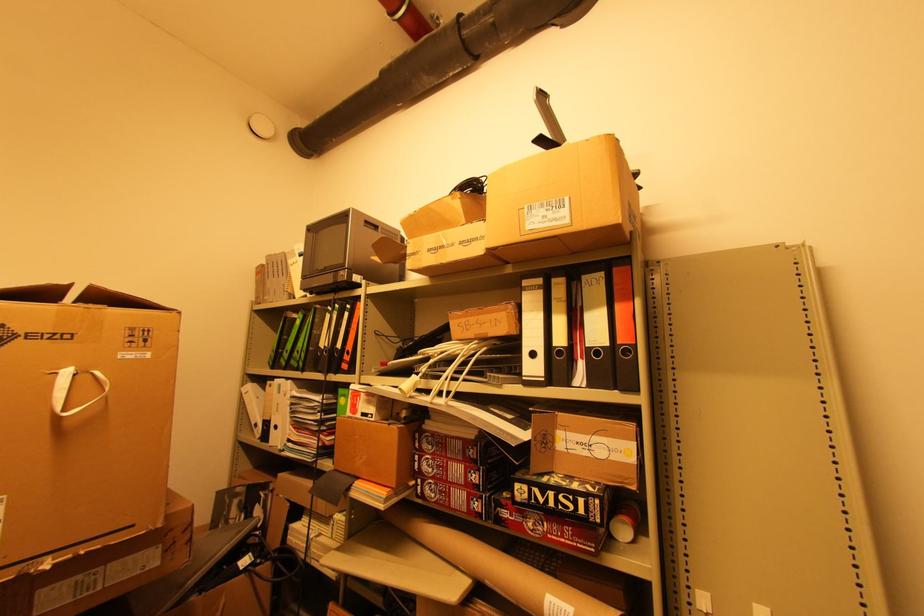
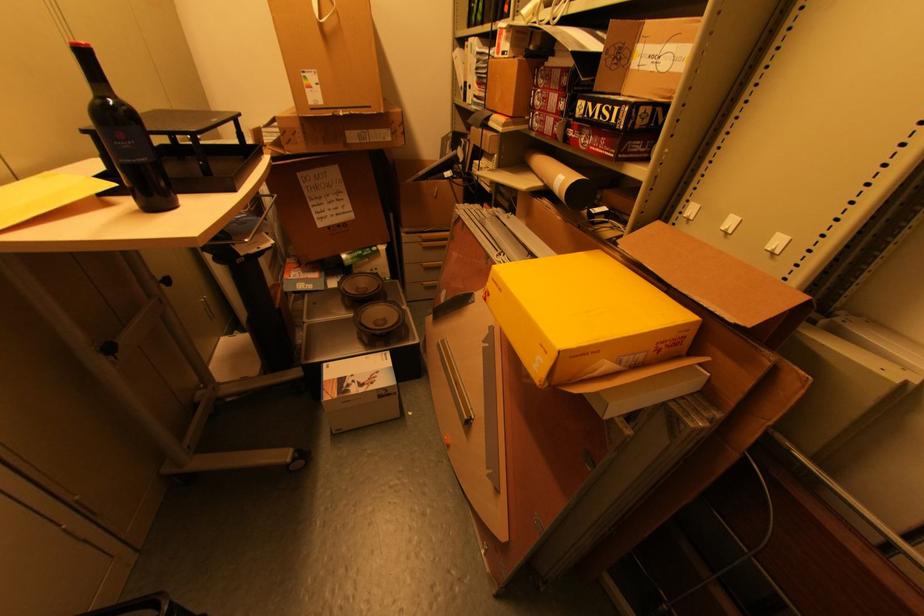
Find the pixel in the second image that matches (568,498) in the first image.

(610, 108)